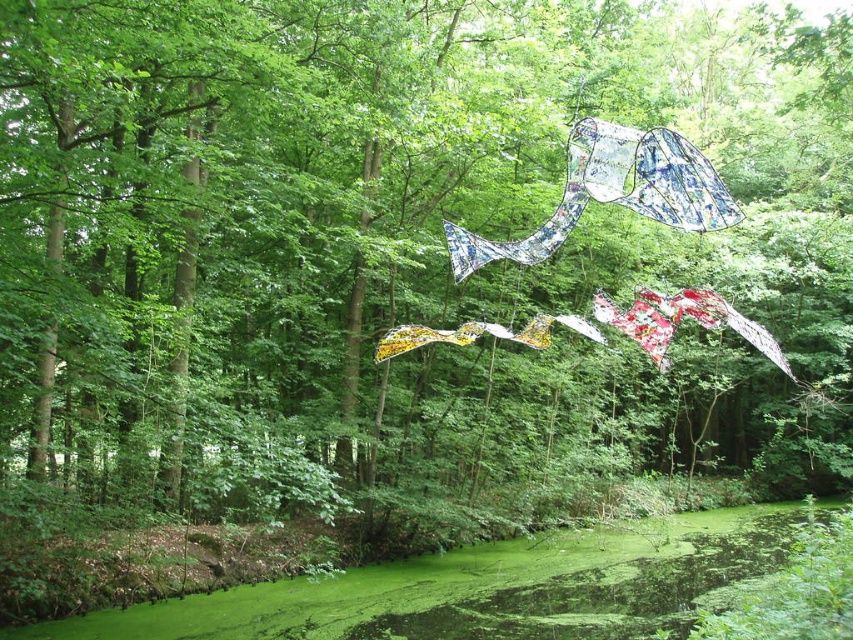
Who is higher up, green algae-covered water at lower center or recycled plastic kite at center?

Positioned higher is recycled plastic kite at center.

Where is `green algae-covered water at lower center`? This screenshot has width=853, height=640. green algae-covered water at lower center is located at coordinates click(480, 589).